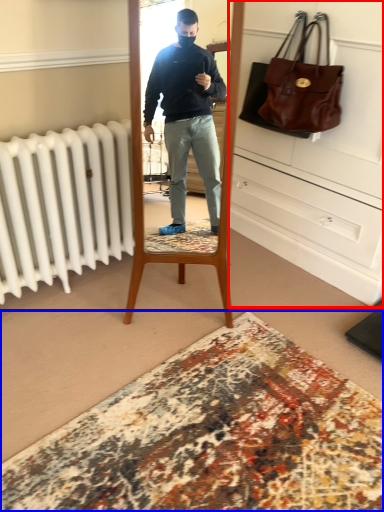
Question: Which point is closer to the camera, dresser (highlighted by a red box) or plain (highlighted by a blue box)?

Choices:
 (A) dresser
 (B) plain

Answer: (B)